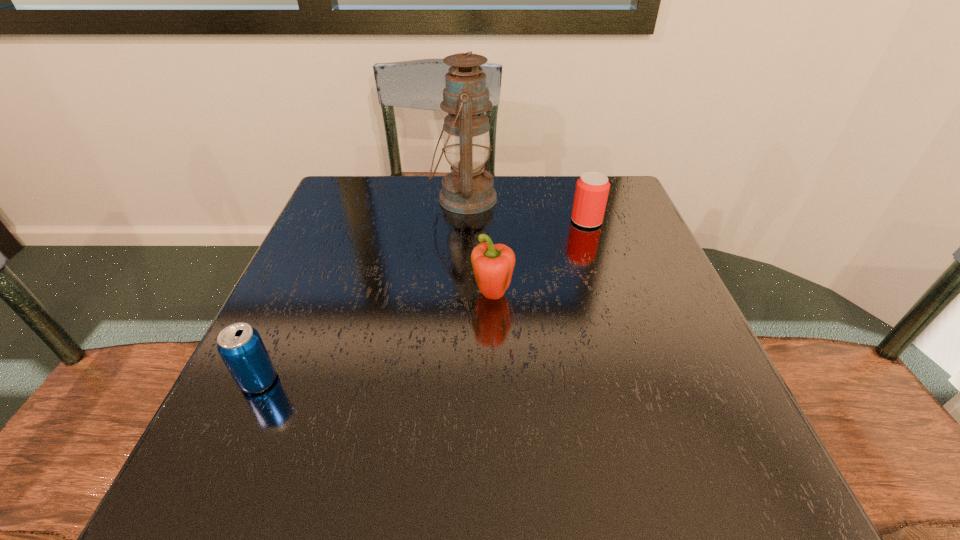
In order to click on the tallest object in this screenshot , I will do `click(469, 189)`.

Find the location of a particular element. pepper is located at coordinates (493, 265).

Locate an element on the screen. the third farthest object is located at coordinates (493, 265).

This screenshot has height=540, width=960. I want to click on beer can, so click(592, 188).

Locate an element on the screen. The width and height of the screenshot is (960, 540). pop soda is located at coordinates (240, 346).

Where is `the nearest object`? The height and width of the screenshot is (540, 960). the nearest object is located at coordinates (240, 346).

Identify the location of free space located 0.260m on the left of the tallest object. (332, 199).

Where is `free spot located 0.200m on the front of the second nearest object`? This screenshot has width=960, height=540. free spot located 0.200m on the front of the second nearest object is located at coordinates (495, 404).

You are a GUI agent. You are given a task and a screenshot of the screen. Output one action in this format:
    pyautogui.click(x=<x>, y=<y>)
    Task: Click on the free space located 0.260m on the left of the beer can
    This screenshot has height=540, width=960.
    Given the screenshot: What is the action you would take?
    pyautogui.click(x=465, y=221)

Identify the location of vacant space located 0.120m on the back of the pop soda. Image resolution: width=960 pixels, height=540 pixels. (289, 315).